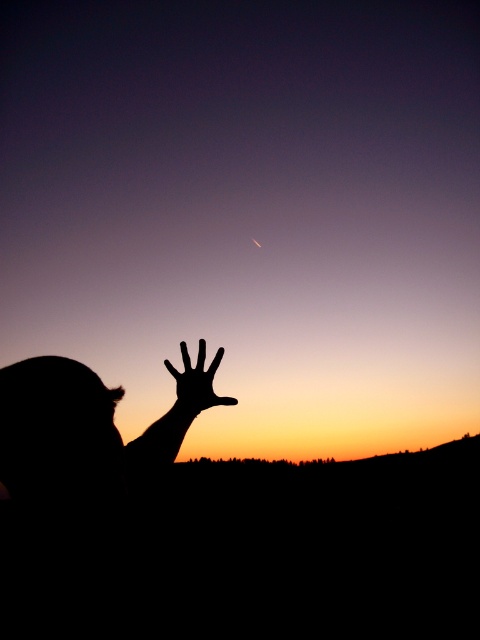
What do you see at coordinates (195, 385) in the screenshot? Image resolution: width=480 pixels, height=640 pixels. I see `black matte hand at upper center` at bounding box center [195, 385].

Between black matte hand at upper center and silvery reflective moon at center, which one appears on the right side from the viewer's perspective?

Positioned to the right is silvery reflective moon at center.

Where is `black matte hand at upper center`? black matte hand at upper center is located at coordinates (195, 385).